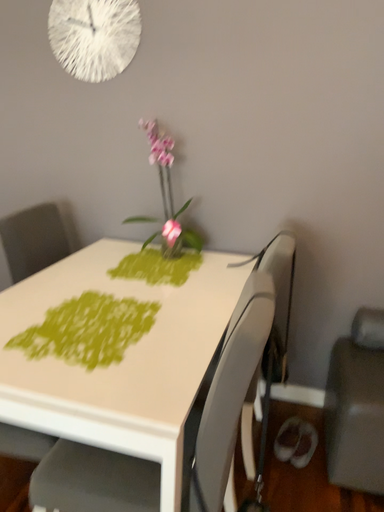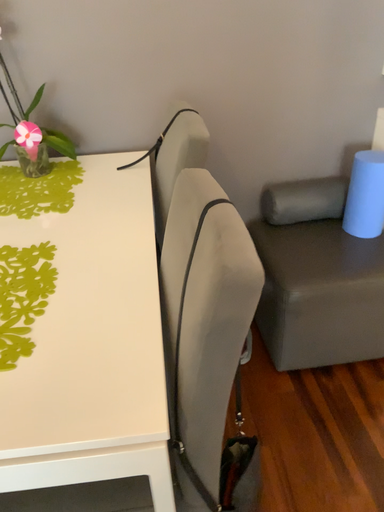
Question: Which way did the camera rotate in the video?

Choices:
 (A) rotated downward
 (B) rotated upward

Answer: (A)